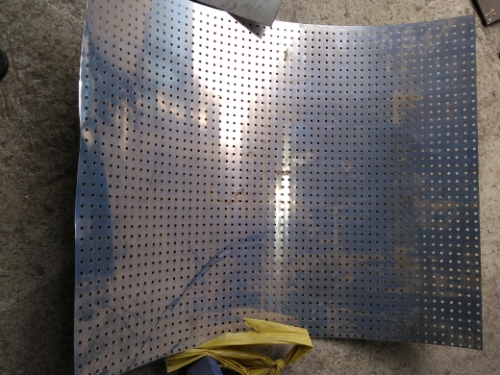
Where is `carpet background`? This screenshot has height=375, width=500. carpet background is located at coordinates (57, 150).